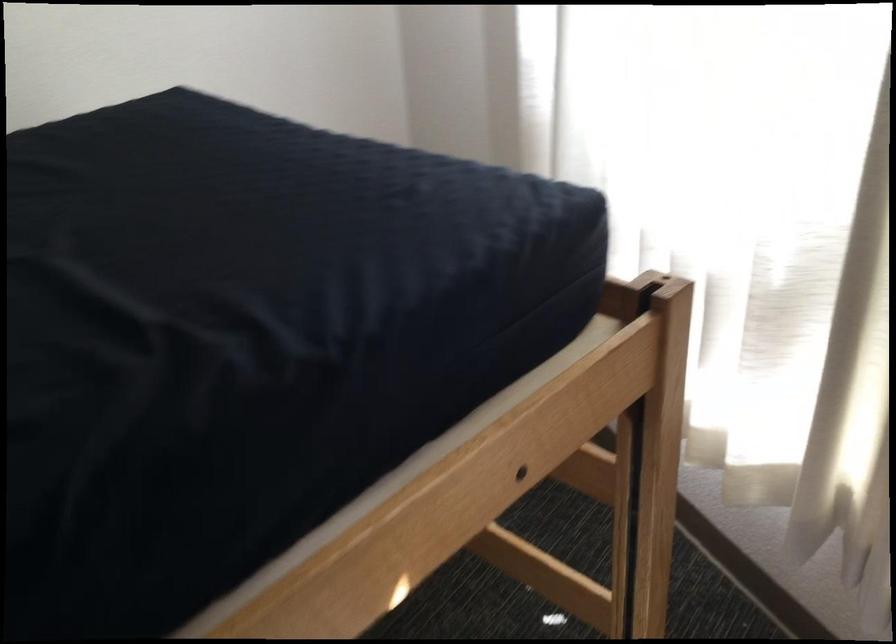
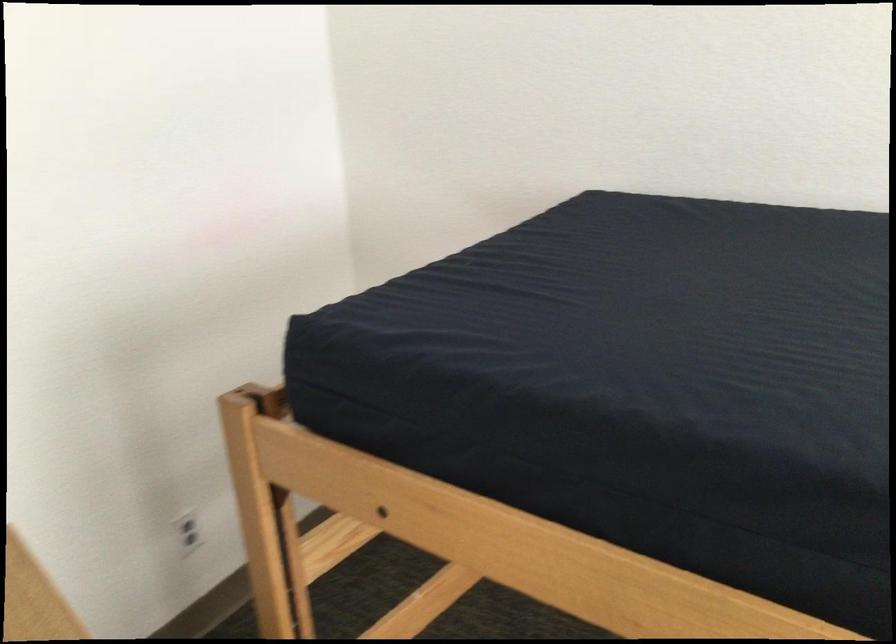
The images are taken continuously from a first-person perspective. In which direction is your viewpoint rotating?

The camera's rotation is toward left-down.